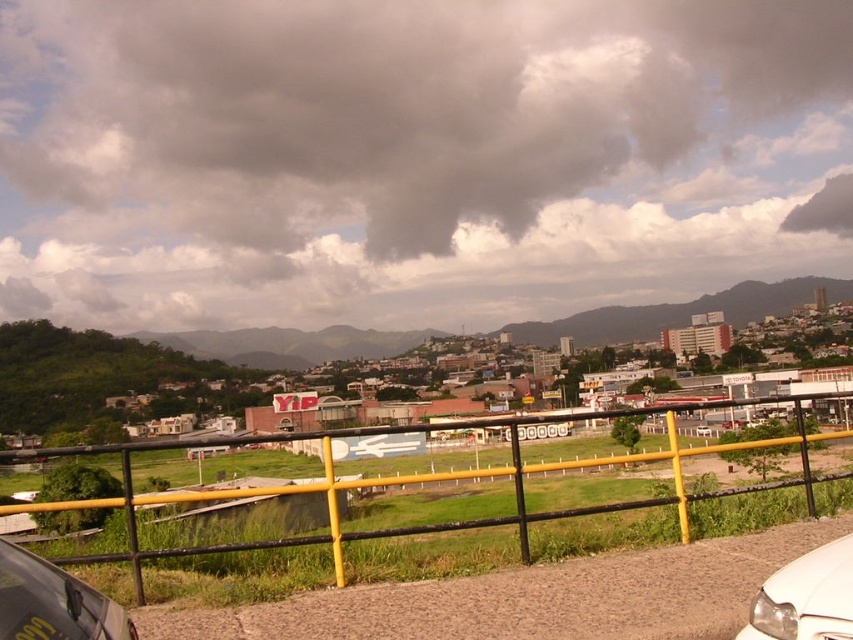
You are a city planner analyzing the parking layout in the foreground. You need to fit both the metallic silver car at lower left and the white glossy car at lower right into a designated parking spot. Which car requires a larger parking space?

The white glossy car at lower right requires a larger parking space because it occupies more space than the metallic silver car at lower left according to the description.

You are standing at the edge of a grassy field and want to take a photo of the cityscape behind the yellow metal fence at center. Your camera has a maximum focus range of 10 feet. Will you be able to capture the city clearly?

The distance between you and the yellow metal fence at center is 9.06 feet, which is within the camera maximum focus range of 10 feet. Therefore, you can capture the city clearly.

You are standing on the paved area near the yellow and black railing. You see both the metallic silver car at lower left and the white glossy car at lower right. Which car is positioned higher from the ground level?

The metallic silver car at lower left is located above the white glossy car at lower right, so it is positioned higher from the ground level.